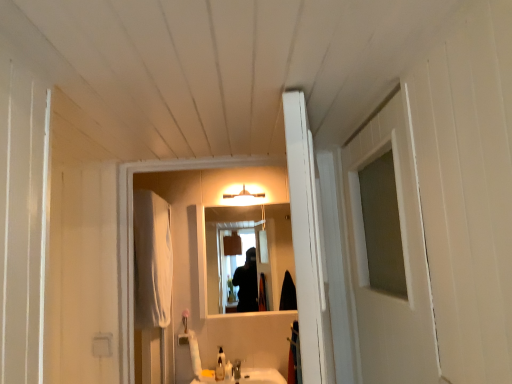
Question: Would you say translucent glass bottle at lower center is to the left or to the right of translucent plastic soap at center in the picture?

Choices:
 (A) right
 (B) left

Answer: (B)

Question: From the image's perspective, is translucent glass bottle at lower center above or below translucent plastic soap at center?

Choices:
 (A) below
 (B) above

Answer: (B)

Question: Which object is positioned closest to the white fabric curtain at left?

Choices:
 (A) white wooden door at center
 (B) translucent glass bottle at lower center
 (C) matte white light fixture at upper center
 (D) translucent plastic soap at center
 (E) clear glass mirror at center

Answer: (C)

Question: Which is nearer to the matte white light fixture at upper center?

Choices:
 (A) white wooden door at center
 (B) white fabric curtain at left
 (C) translucent glass bottle at lower center
 (D) satin nickel faucet at lower center
 (E) clear glass mirror at center

Answer: (B)